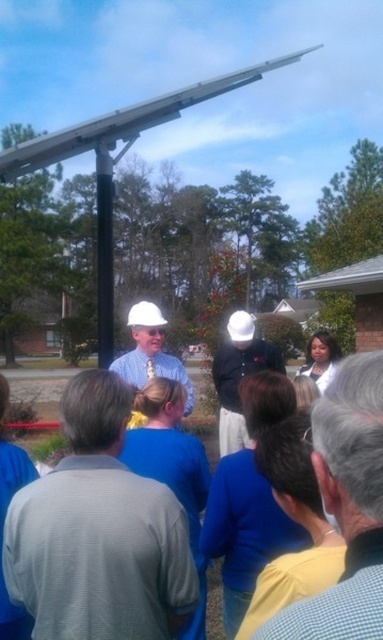
You are a photographer trying to capture a clear shot of both the light blue shirt at center and the matte black hard hat at center. Since you want to ensure both are visible, which object should you focus on first considering their sizes?

The light blue shirt at center has a lesser width compared to the matte black hard hat at center, so you should focus on the light blue shirt at center first to ensure its smaller size is captured clearly.

In the scene shown: You are standing at the point marked by the coordinates point (238, 376) in the image. Looking around, you see a solar panel mounted on a black pole. Can you tell me what object is located exactly at your current position?

The point (238, 376) marks the location of the matte black hard hat at center.

You are a photographer at the event and want to capture both the matte black hard hat at center and the matte white hard hat at center in a single photo. Which hard hat should you focus on first to ensure both are in frame?

The matte black hard hat at center is positioned on the right side of matte white hard hat at center, so focusing on the matte white hard hat at center first would allow you to include both in the frame as they are aligned horizontally.